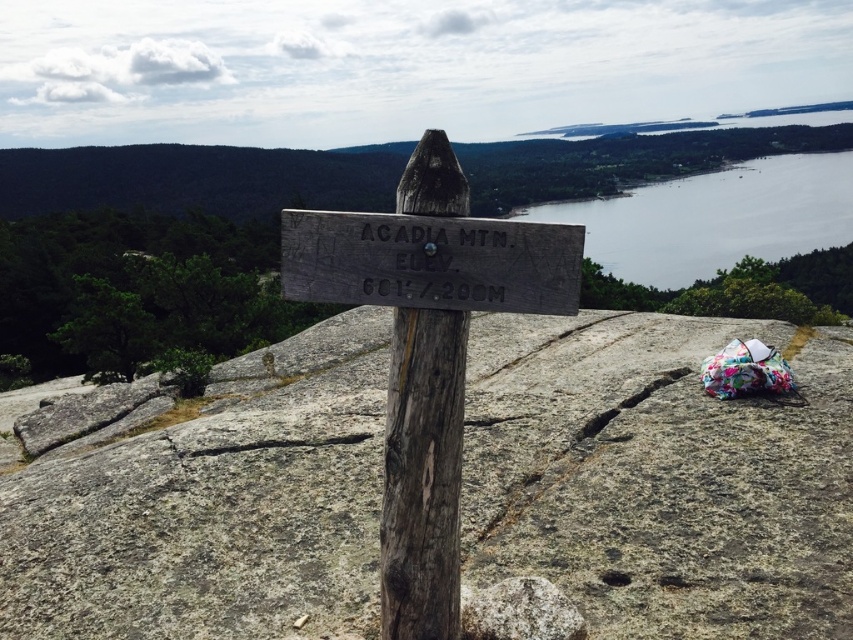
Question: Is gray rough rock at center smaller than weathered wood sign at center?

Choices:
 (A) yes
 (B) no

Answer: (A)

Question: Estimate the real-world distances between objects in this image. Which object is closer to the white textured rock at center?

Choices:
 (A) weathered wood sign at center
 (B) weathered wood signpost at center
 (C) gray water at upper right
 (D) gray rough rock at center

Answer: (B)

Question: Does gray water at upper right have a smaller size compared to white textured rock at center?

Choices:
 (A) no
 (B) yes

Answer: (A)

Question: Which point is farther to the camera?

Choices:
 (A) white textured rock at center
 (B) weathered wood sign at center

Answer: (A)

Question: Which point is closer to the camera taking this photo?

Choices:
 (A) (637, 244)
 (B) (405, 433)
 (C) (511, 243)
 (D) (506, 598)

Answer: (C)

Question: Is gray rough rock at center wider than gray water at upper right?

Choices:
 (A) yes
 (B) no

Answer: (B)